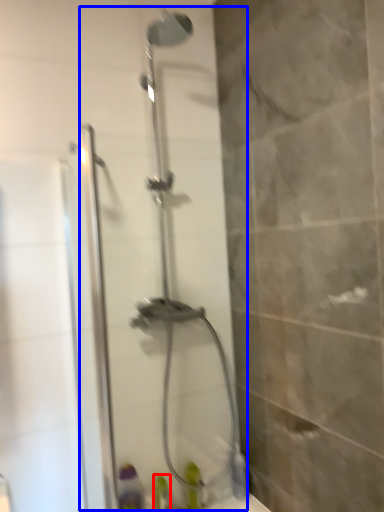
Question: Among these objects, which one is farthest to the camera, toiletry (highlighted by a red box) or shower door (highlighted by a blue box)?

Choices:
 (A) toiletry
 (B) shower door

Answer: (A)